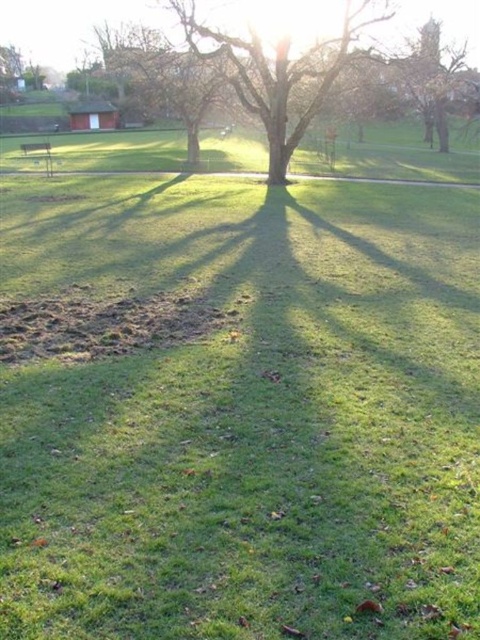
Is point (276, 147) positioned after point (427, 122)?

That is False.

Is point (259, 42) farther from viewer compared to point (439, 136)?

No, (259, 42) is in front of (439, 136).

The image size is (480, 640). Find the location of `smooth brown tree at center`. smooth brown tree at center is located at coordinates (279, 72).